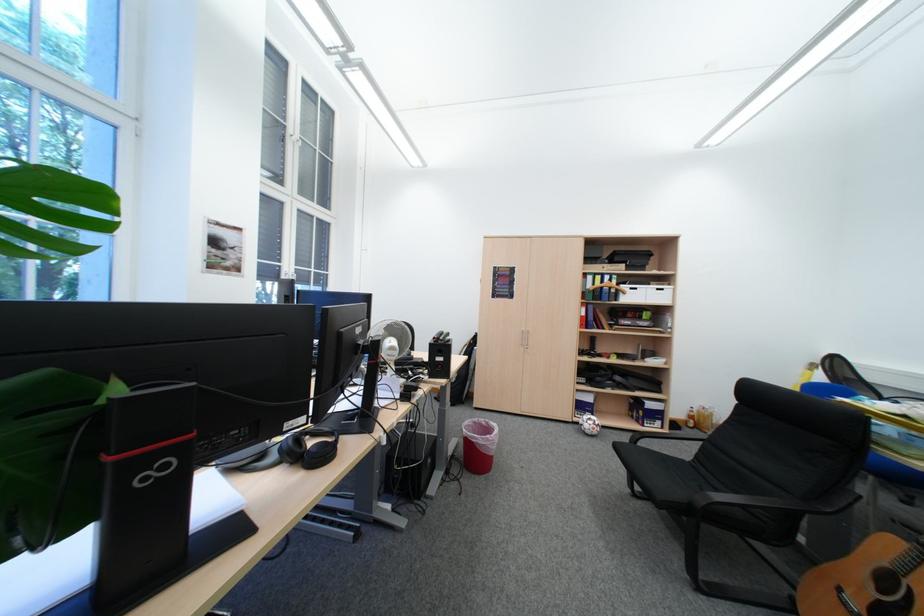
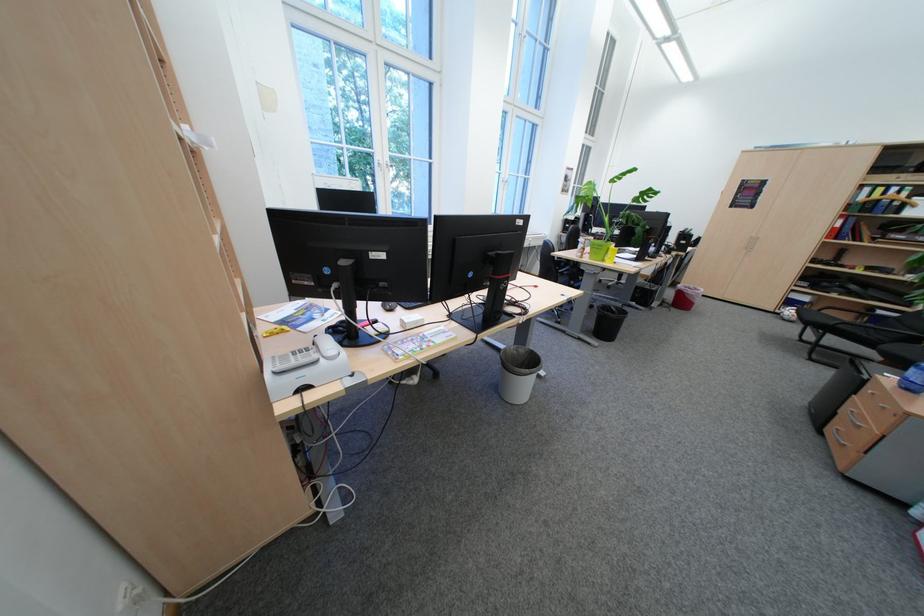
In the second image, find the point that corresponds to point 598,427 in the first image.

(798, 314)